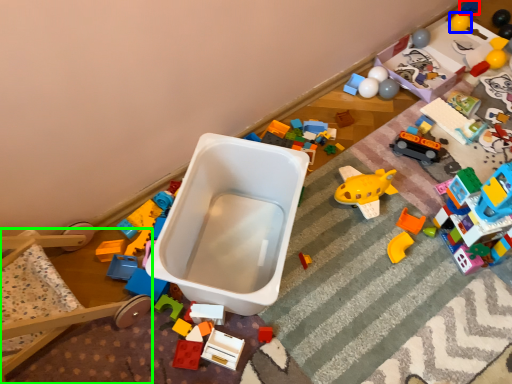
Question: Considering the real-world distances, which object is closest to toy (highlighted by a red box)? toy (highlighted by a blue box) or bunk bed (highlighted by a green box).

Choices:
 (A) toy
 (B) bunk bed

Answer: (A)